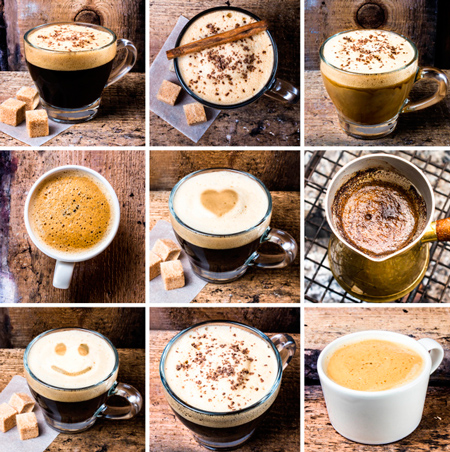
This screenshot has width=450, height=452. What are the coordinates of `wood table surface` in the screenshot? It's located at (120, 124), (161, 131), (319, 126), (259, 289), (31, 270), (126, 367), (170, 437), (318, 433).